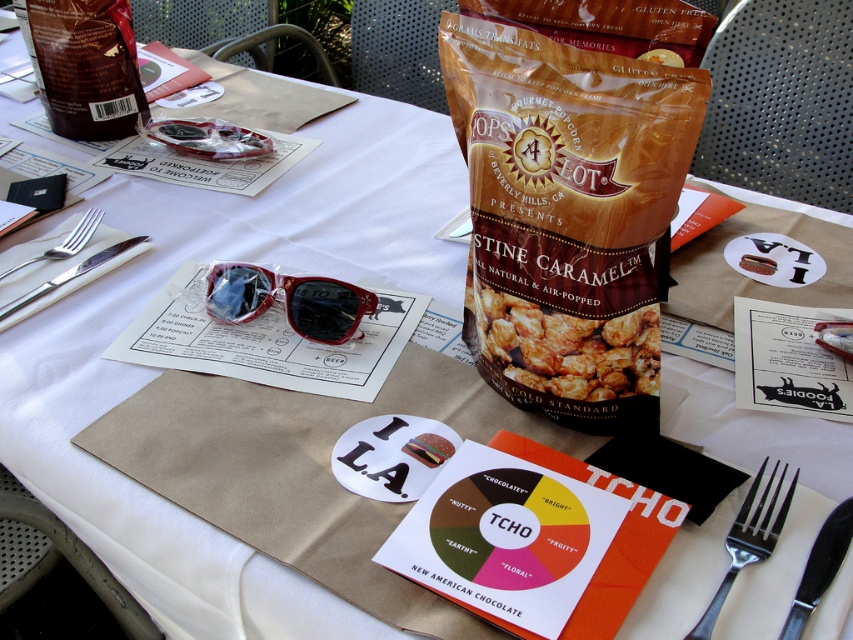
Between black metal knife at lower right and satin silver fork at left, which one has less height?

Standing shorter between the two is black metal knife at lower right.

Is black metal knife at lower right bigger than satin silver fork at left?

No, black metal knife at lower right is not bigger than satin silver fork at left.

Find the location of a particular element. black metal knife at lower right is located at coordinates (820, 566).

Is point (500, 342) positioned before point (782, 500)?

No, it is not.

Which is behind, point (538, 376) or point (795, 474)?

The point (538, 376) is behind.

Where is `caramelized popcorn at center`? caramelized popcorn at center is located at coordinates (570, 348).

Looking at this image, does shiny red plastic sunglasses at center appear on the left side of satin silver fork at left?

Incorrect, shiny red plastic sunglasses at center is not on the left side of satin silver fork at left.

Is point (350, 321) farther from viewer compared to point (96, 218)?

No, (350, 321) is closer to viewer.

The width and height of the screenshot is (853, 640). Find the location of `shiny red plastic sunglasses at center`. shiny red plastic sunglasses at center is located at coordinates (288, 300).